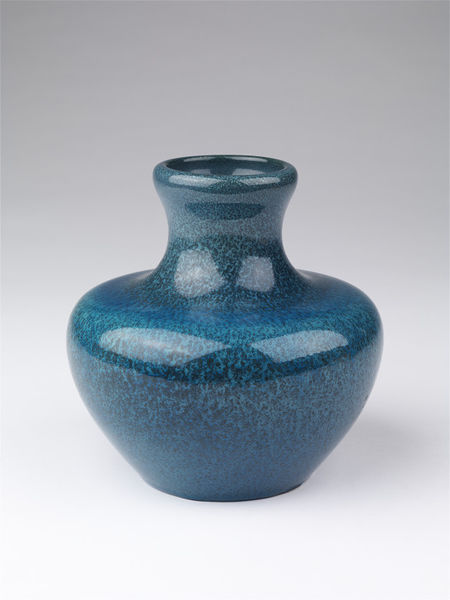
Find the location of a particular element. Image resolution: width=450 pixels, height=600 pixels. top of pot is located at coordinates (221, 158).